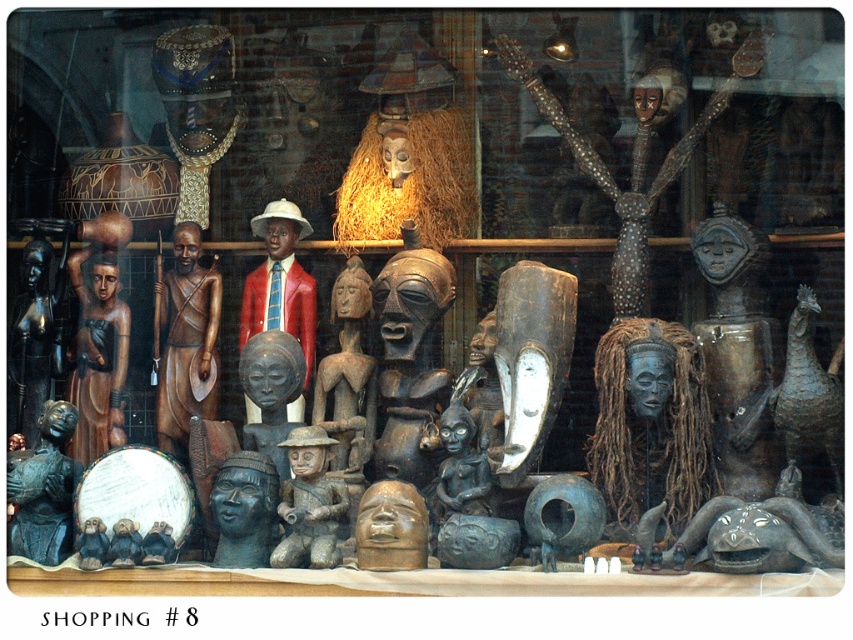
You are an art curator planning to display the wooden mask at center and the brown wood figure at center in a new exhibition. Which object should be placed higher on the display shelf to ensure both are visible without blocking each other?

The wooden mask at center is larger, so placing it higher on the display shelf will allow the smaller brown wood figure at center to be seen below it without obstruction.

Looking at this image, you are an art curator arranging a display. You have a wooden mask at center and a brown wood figure at center. According to the spatial arrangement in the scene, which object is positioned to the right of the other?

The wooden mask at center is to the right of the brown wood figure at center.